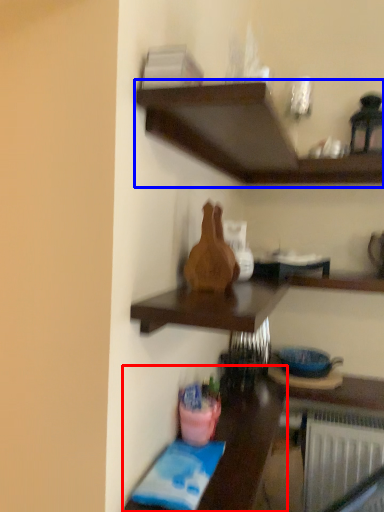
Question: Which of the following is the farthest to the observer, table (highlighted by a red box) or shelf (highlighted by a blue box)?

Choices:
 (A) table
 (B) shelf

Answer: (A)